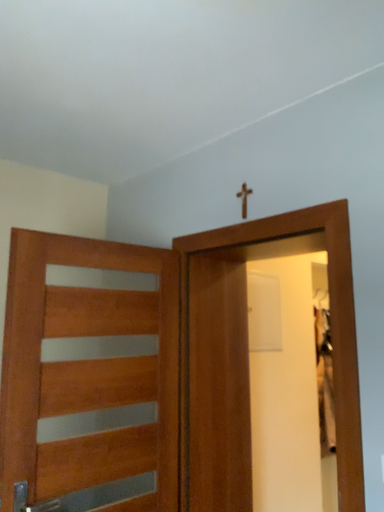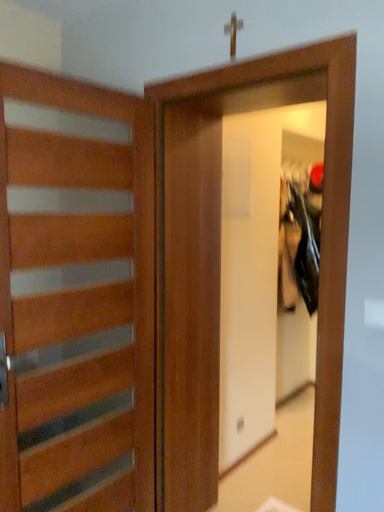
Question: How did the camera likely rotate when shooting the video?

Choices:
 (A) rotated downward
 (B) rotated upward

Answer: (A)